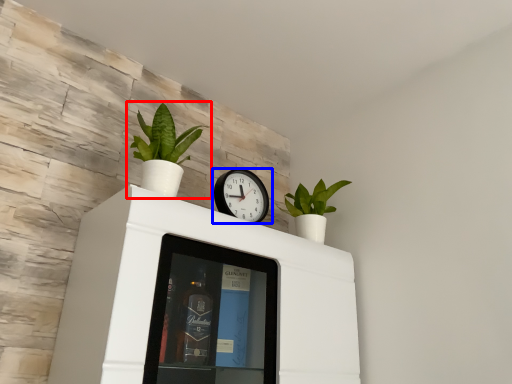
Question: Which object is closer to the camera taking this photo, houseplant (highlighted by a red box) or wall clock (highlighted by a blue box)?

Choices:
 (A) houseplant
 (B) wall clock

Answer: (A)